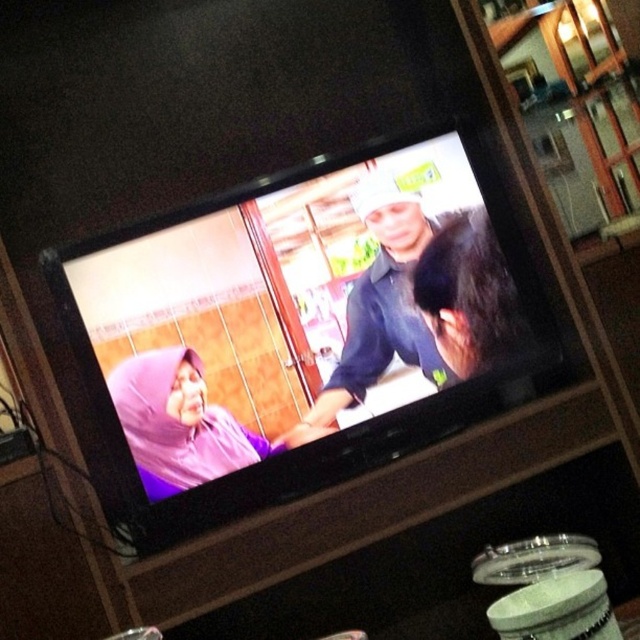
You are a photographer trying to capture a closeup of the dark blue shirt at center and the purple fabric headscarf at center on the TV screen. Since the camera can only focus on one object at a time, which object should you choose to ensure the other is still partially visible in the frame?

The dark blue shirt at center has a lesser width compared to the purple fabric headscarf at center, so you should focus on the purple fabric headscarf at center to ensure the smaller dark blue shirt at center remains partially visible in the frame.

You are a person standing in front of the TV. You want to know which object is higher between the dark blue shirt at center and the purple fabric headscarf at center. Can you tell me?

The dark blue shirt at center is above the purple fabric headscarf at center, so the dark blue shirt at center is higher.

You are watching the TV and see two points on the screen. The first point is at position (349, 404) and the second is at (228, 470). Which point is closer to the bottom edge of the TV screen?

Point (228, 470) is closer to the bottom edge of the TV screen because its y coordinate is smaller than the other point.